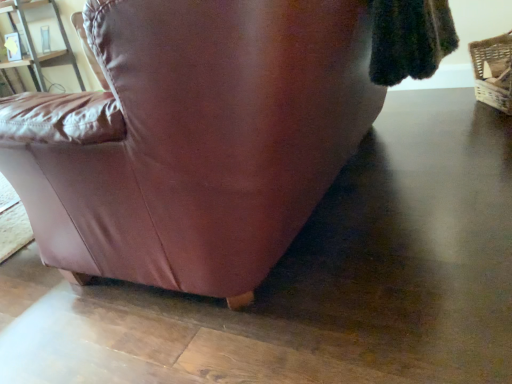
Question: Which is correct: woven straw basket at right is inside matte wood shelf at upper left, or outside of it?

Choices:
 (A) inside
 (B) outside

Answer: (B)

Question: Is point (479, 59) positioned closer to the camera than point (40, 77)?

Choices:
 (A) farther
 (B) closer

Answer: (B)

Question: From the image's perspective, relative to matte wood shelf at upper left, is woven straw basket at right above or below?

Choices:
 (A) above
 (B) below

Answer: (B)

Question: Is matte wood shelf at upper left to the left or to the right of woven straw basket at right in the image?

Choices:
 (A) right
 (B) left

Answer: (B)

Question: In terms of width, does matte wood shelf at upper left look wider or thinner when compared to woven straw basket at right?

Choices:
 (A) wide
 (B) thin

Answer: (A)

Question: Does point (59, 23) appear closer or farther from the camera than point (499, 92)?

Choices:
 (A) closer
 (B) farther

Answer: (B)

Question: Considering the positions of matte wood shelf at upper left and woven straw basket at right in the image, is matte wood shelf at upper left taller or shorter than woven straw basket at right?

Choices:
 (A) tall
 (B) short

Answer: (A)